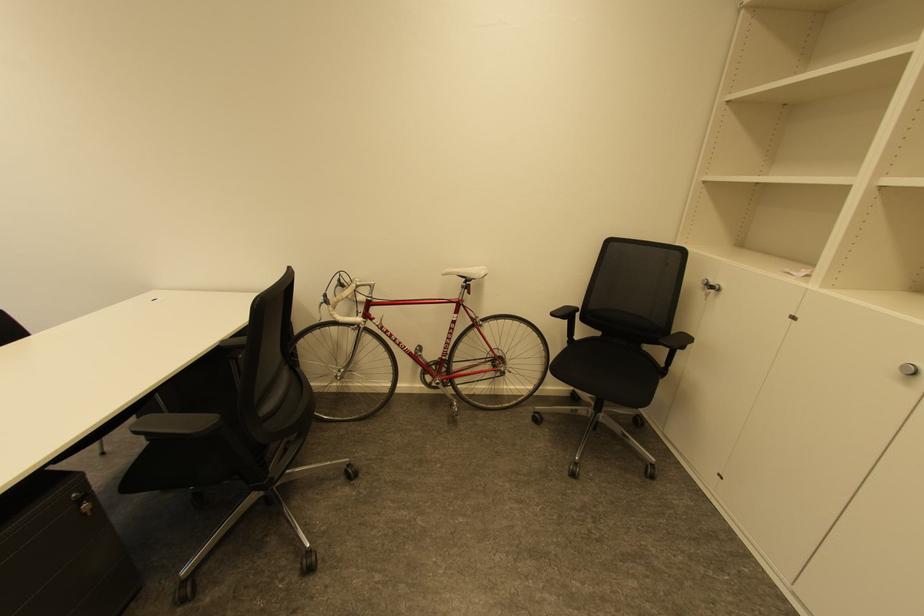
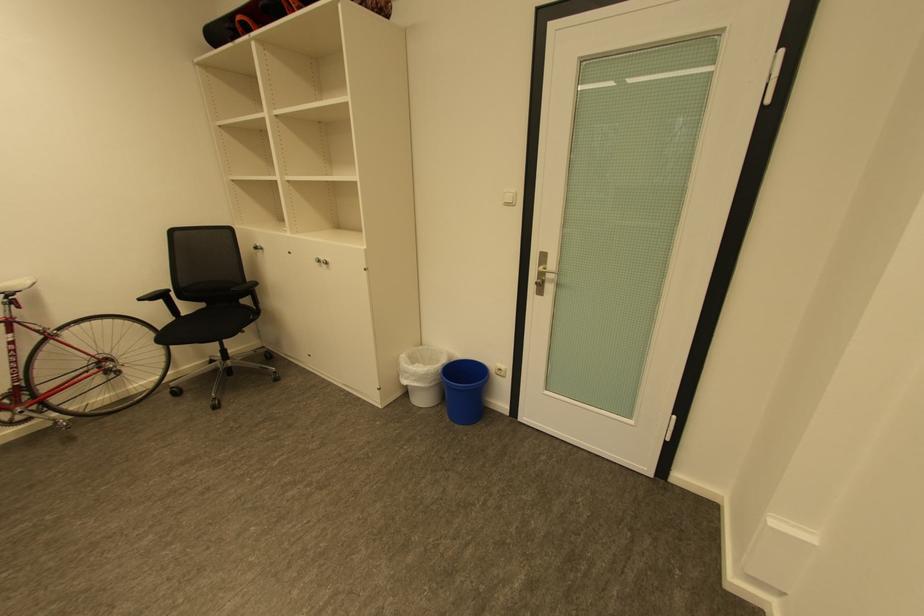
Locate, in the second image, the point that corresponds to (584,338) in the first image.

(190, 315)